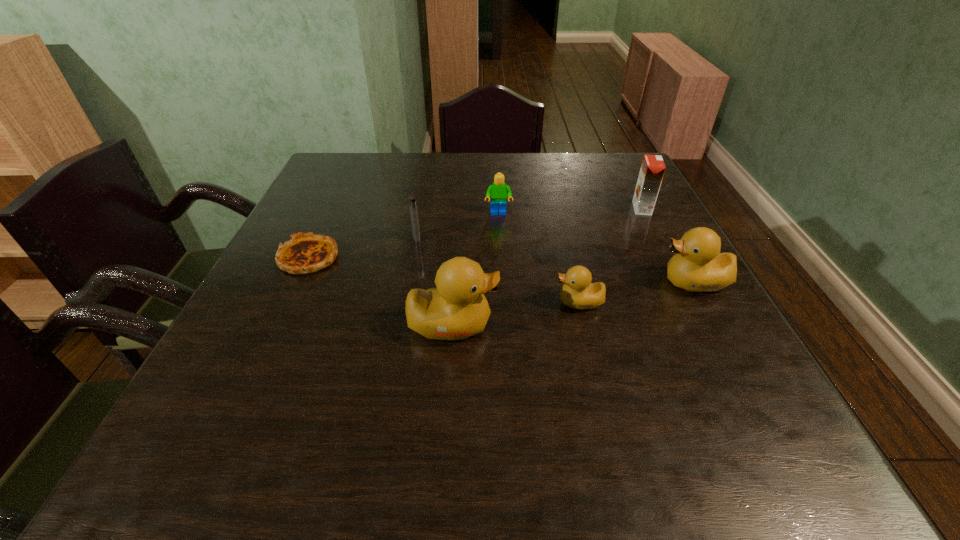
Where is `free space between the rightmost duckling and the Lego`? The image size is (960, 540). free space between the rightmost duckling and the Lego is located at coordinates [596, 248].

Locate an element on the screen. free space that is in between the quiche and the second tallest duckling is located at coordinates (501, 270).

Locate an element on the screen. This screenshot has width=960, height=540. free point between the Lego and the orange juice is located at coordinates (570, 211).

Where is `vacant space in between the orange juice and the sixth object from right to left`? vacant space in between the orange juice and the sixth object from right to left is located at coordinates point(529,223).

At what (x,y) coordinates should I click in order to perform the action: click on free area in between the third object from right to left and the leftmost duckling. Please return your answer as a coordinate pair (x, y). This screenshot has height=540, width=960. Looking at the image, I should click on (516, 313).

Identify the location of unoccupied position between the orange juice and the Lego. The image size is (960, 540). (570, 211).

You are a GUI agent. You are given a task and a screenshot of the screen. Output one action in this format:
    pyautogui.click(x=<x>, y=<y>)
    Task: Click on the object that is the closest to the leftmost duckling
    Image resolution: width=960 pixels, height=540 pixels.
    Given the screenshot: What is the action you would take?
    pyautogui.click(x=578, y=292)

Identify which object is located as the third nearest to the orange juice. Please provide its 2D coordinates. Your answer should be formatted as a tuple, i.e. [(x, y)], where the tuple contains the x and y coordinates of a point satisfying the conditions above.

[(578, 292)]

Find the location of a particular element. duckling identified as the third closest to the quiche is located at coordinates (698, 266).

Identify which duckling is the second nearest to the sixth object from right to left. Please provide its 2D coordinates. Your answer should be formatted as a tuple, i.e. [(x, y)], where the tuple contains the x and y coordinates of a point satisfying the conditions above.

[(578, 292)]